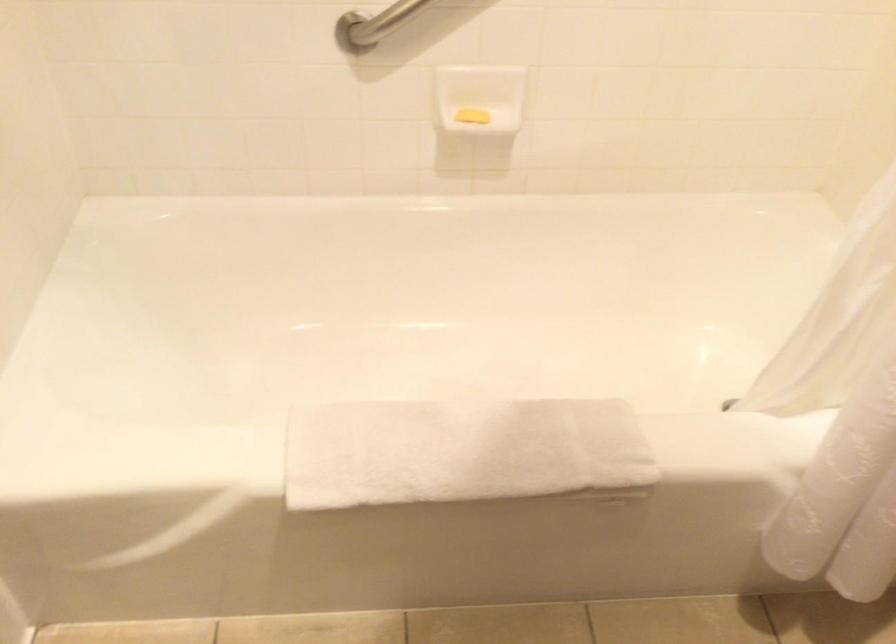
Locate an element on the screen. Image resolution: width=896 pixels, height=644 pixels. metal grab bar is located at coordinates (375, 24).